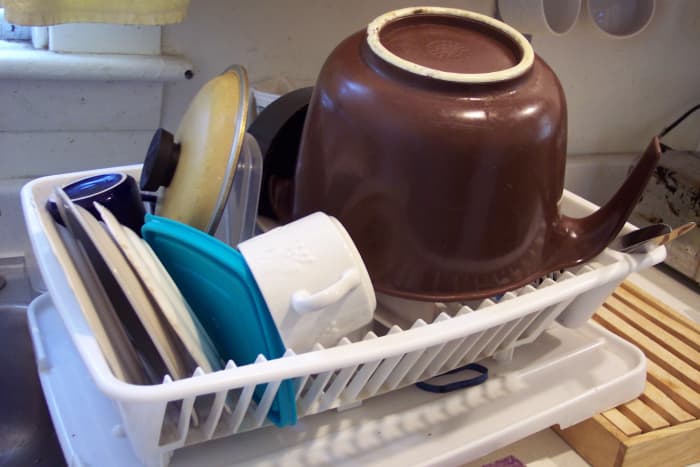
You are a GUI agent. You are given a task and a screenshot of the screen. Output one action in this format:
    pyautogui.click(x=<x>, y=<y>)
    Task: Click on the plates
    
    Given the screenshot: What is the action you would take?
    pyautogui.click(x=164, y=264), pyautogui.click(x=132, y=289)